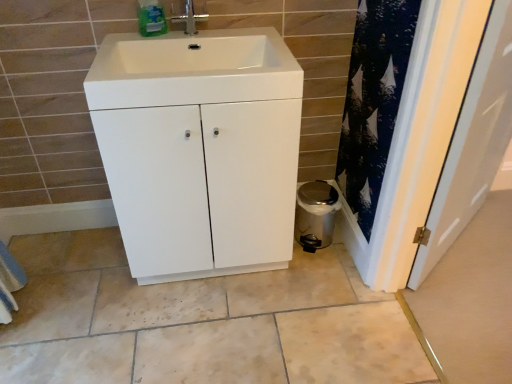
Locate an element on the screen. unoccupied region to the right of silver metallic tap at upper center is located at coordinates (237, 38).